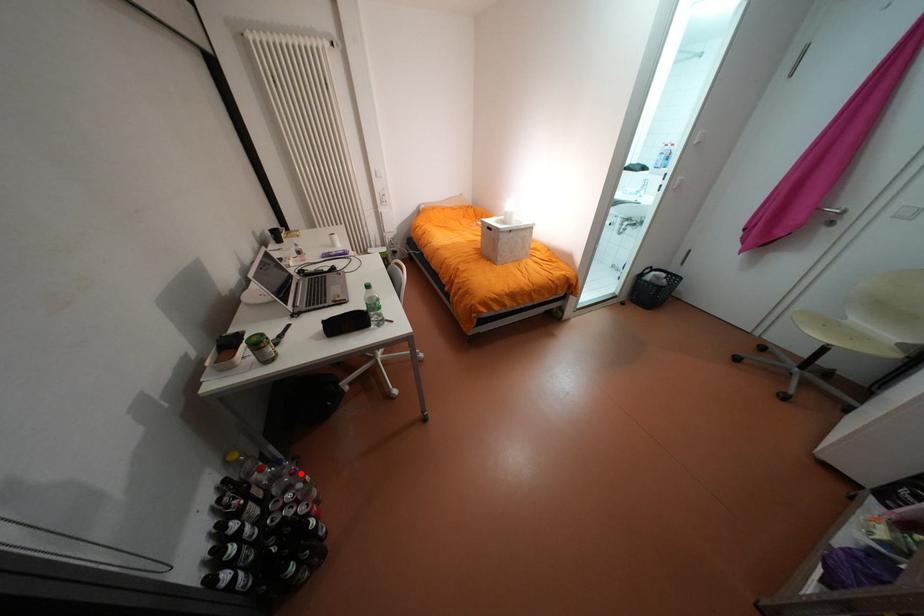
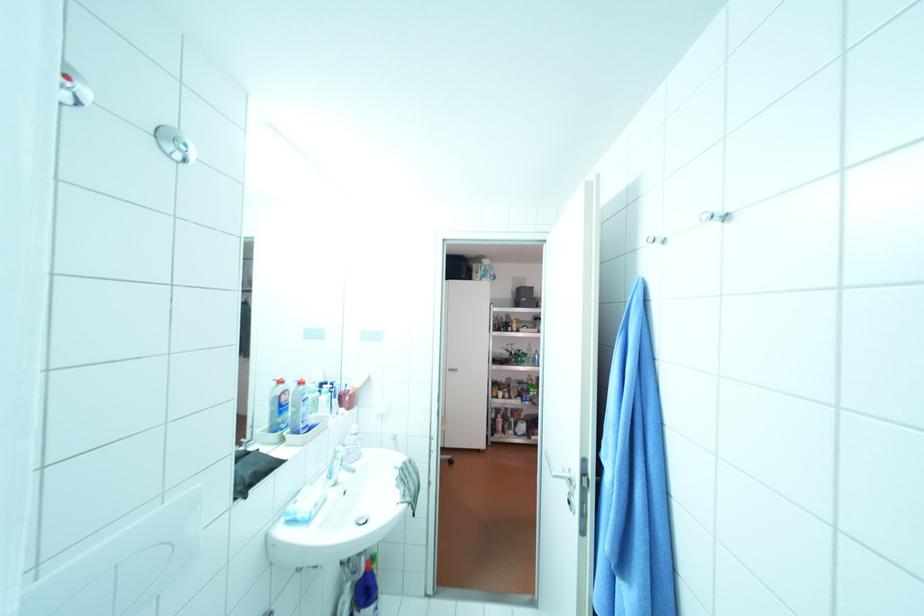
Question: I am providing you with two images of the same scene from different viewpoints. A red point is marked on the first image. Is the red point's position out of view in image 2?

Choices:
 (A) Yes
 (B) No

Answer: (A)